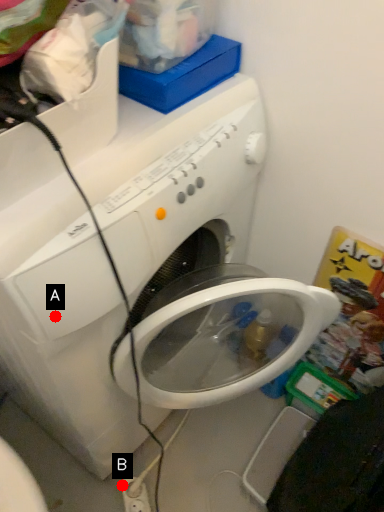
Question: Two points are circled on the image, labeled by A and B beside each circle. Which point is closer to the camera?

Choices:
 (A) A is closer
 (B) B is closer

Answer: (A)